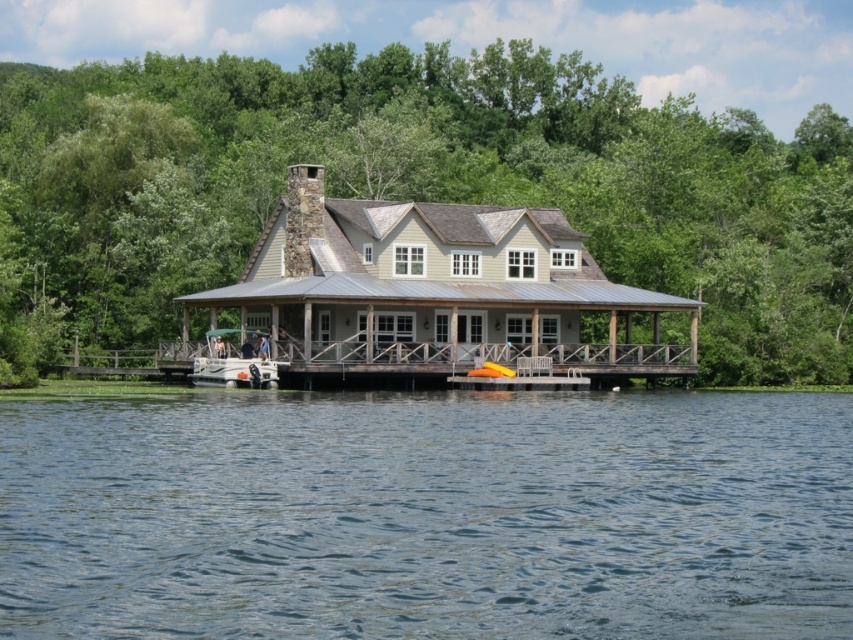
Question: Can you confirm if clear blue water at center is positioned to the right of wooden at center?

Choices:
 (A) yes
 (B) no

Answer: (A)

Question: Can you confirm if clear blue water at center is bigger than white plastic boat at center?

Choices:
 (A) no
 (B) yes

Answer: (B)

Question: Which point appears farthest from the camera in this image?

Choices:
 (A) (204, 372)
 (B) (492, 346)

Answer: (B)

Question: Which of these objects is positioned closest to the white plastic boat at center?

Choices:
 (A) clear blue water at center
 (B) wooden at center

Answer: (B)

Question: Is wooden at center to the right of white plastic boat at center from the viewer's perspective?

Choices:
 (A) yes
 (B) no

Answer: (A)

Question: Which point appears closest to the camera in this image?

Choices:
 (A) (209, 332)
 (B) (461, 349)

Answer: (A)